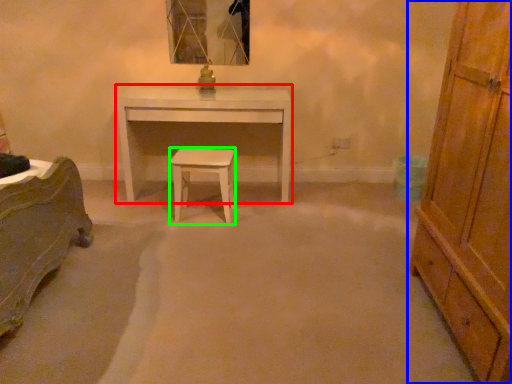
Question: Which is nearer to the desk (highlighted by a red box)? chest of drawers (highlighted by a blue box) or stool (highlighted by a green box).

Choices:
 (A) chest of drawers
 (B) stool

Answer: (B)